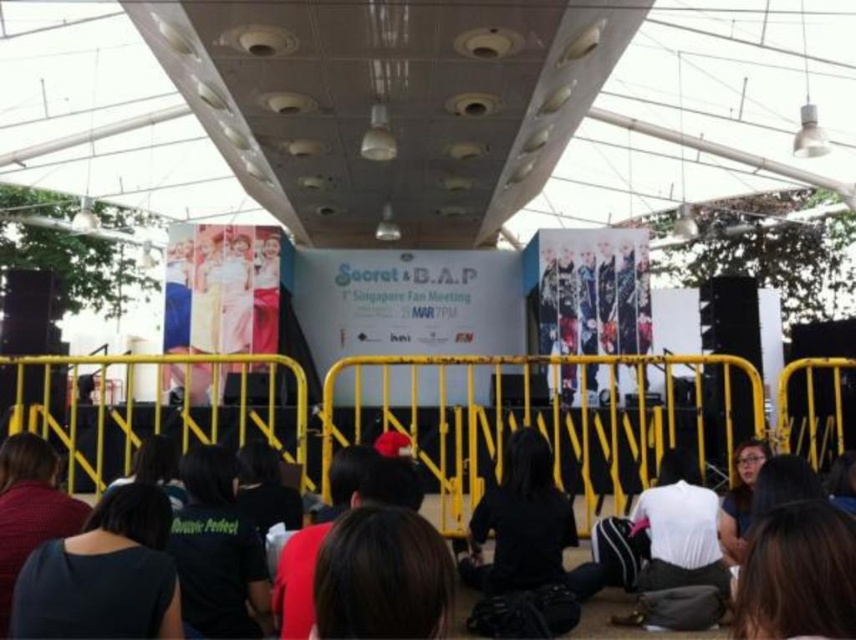
Question: Does dark blue fabric at lower left have a greater width compared to black fabric crowd at lower center?

Choices:
 (A) yes
 (B) no

Answer: (A)

Question: Can you confirm if dark blue fabric at lower left is positioned below black fabric crowd at lower center?

Choices:
 (A) yes
 (B) no

Answer: (B)

Question: Can you confirm if dark blue fabric at lower left is thinner than black fabric crowd at lower center?

Choices:
 (A) yes
 (B) no

Answer: (B)

Question: Which point is farther to the camera?

Choices:
 (A) coord(31,435)
 (B) coord(60,627)

Answer: (A)

Question: Among these points, which one is farthest from the camera?

Choices:
 (A) (31, 465)
 (B) (40, 592)

Answer: (A)